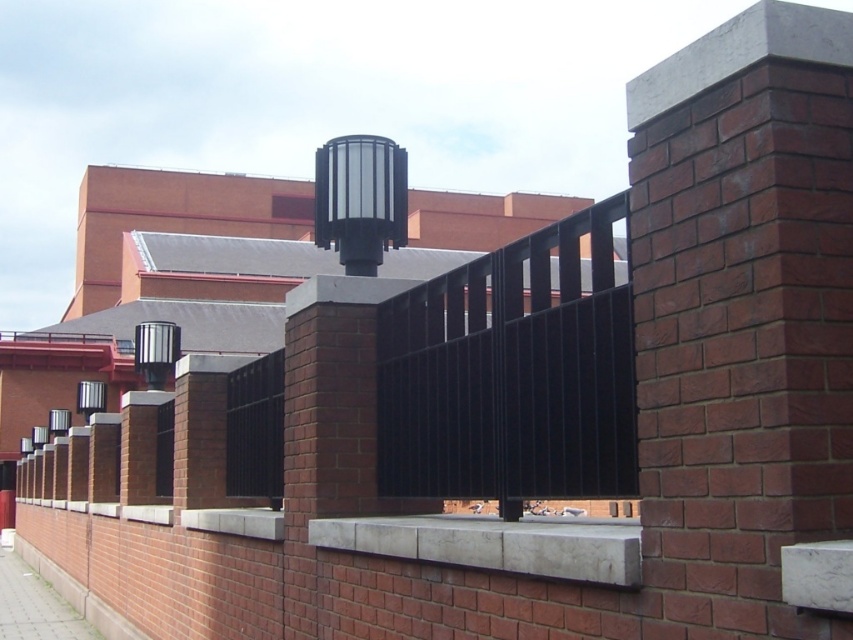
Question: Which of the following is the closest to the observer?

Choices:
 (A) black metal fence at center
 (B) smooth concrete ledge at center

Answer: (B)

Question: Can you confirm if black metal fence at center is thinner than smooth concrete ledge at center?

Choices:
 (A) no
 (B) yes

Answer: (B)

Question: Does black metal fence at center appear on the right side of smooth concrete ledge at center?

Choices:
 (A) no
 (B) yes

Answer: (A)

Question: Can you confirm if black metal fence at center is positioned above smooth concrete ledge at center?

Choices:
 (A) no
 (B) yes

Answer: (B)

Question: Which point is closer to the camera?

Choices:
 (A) (492, 374)
 (B) (318, 540)

Answer: (A)